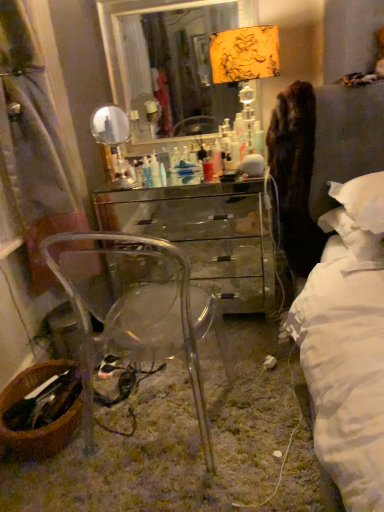
Question: Is the depth of transparent acrylic chair at center less than that of translucent plastic container at center?

Choices:
 (A) no
 (B) yes

Answer: (B)

Question: Does transparent acrylic chair at center have a lesser width compared to translucent plastic container at center?

Choices:
 (A) yes
 (B) no

Answer: (B)

Question: Is transparent acrylic chair at center wider than translucent plastic container at center?

Choices:
 (A) yes
 (B) no

Answer: (A)

Question: From the image's perspective, is transparent acrylic chair at center beneath translucent plastic container at center?

Choices:
 (A) yes
 (B) no

Answer: (A)

Question: Does transparent acrylic chair at center turn towards translucent plastic container at center?

Choices:
 (A) no
 (B) yes

Answer: (B)

Question: Considering their positions, is white soft pillow at right, the second pillow in the bottom-to-top sequence, located in front of or behind metallic silver mirror at upper center?

Choices:
 (A) front
 (B) behind

Answer: (A)

Question: From the image's perspective, is white soft pillow at right, the second pillow in the bottom-to-top sequence, above or below metallic silver mirror at upper center?

Choices:
 (A) below
 (B) above

Answer: (A)

Question: Based on their sizes in the image, would you say white soft pillow at right, the second pillow in the bottom-to-top sequence, is bigger or smaller than metallic silver mirror at upper center?

Choices:
 (A) big
 (B) small

Answer: (B)

Question: Visually, is white soft pillow at right, positioned as the first pillow in top-to-bottom order, positioned to the left or to the right of metallic silver mirror at upper center?

Choices:
 (A) right
 (B) left

Answer: (A)

Question: From the image's perspective, is glossy mirrored chest of drawers at center located above or below translucent plastic container at center?

Choices:
 (A) above
 (B) below

Answer: (B)

Question: From their relative heights in the image, would you say glossy mirrored chest of drawers at center is taller or shorter than translucent plastic container at center?

Choices:
 (A) short
 (B) tall

Answer: (B)

Question: Is glossy mirrored chest of drawers at center situated inside translucent plastic container at center or outside?

Choices:
 (A) inside
 (B) outside

Answer: (B)

Question: From a real-world perspective, is glossy mirrored chest of drawers at center above or below translucent plastic container at center?

Choices:
 (A) above
 (B) below

Answer: (B)

Question: Considering the positions of point [x=254, y=70] and point [x=157, y=181], is point [x=254, y=70] closer or farther from the camera than point [x=157, y=181]?

Choices:
 (A) closer
 (B) farther

Answer: (A)

Question: Looking at their shapes, would you say floral fabric lampshade at upper center is wider or thinner than translucent plastic container at center?

Choices:
 (A) wide
 (B) thin

Answer: (A)